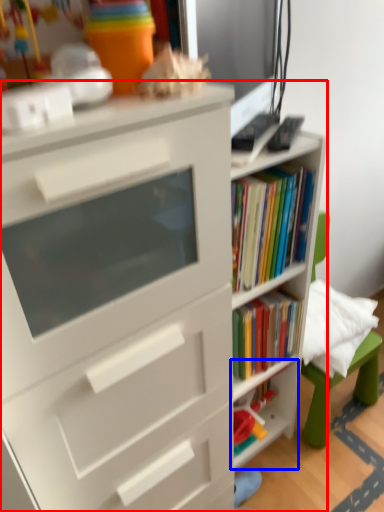
Question: Which of the following is the closest to the observer, bookcase (highlighted by a red box) or shelf (highlighted by a blue box)?

Choices:
 (A) bookcase
 (B) shelf

Answer: (A)